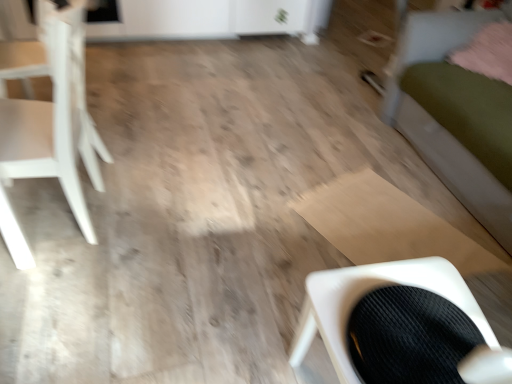
Locate an element on the screen. vacant area that is in front of white matte chair at left, acting as the 2th chair starting from the right is located at coordinates point(55,298).